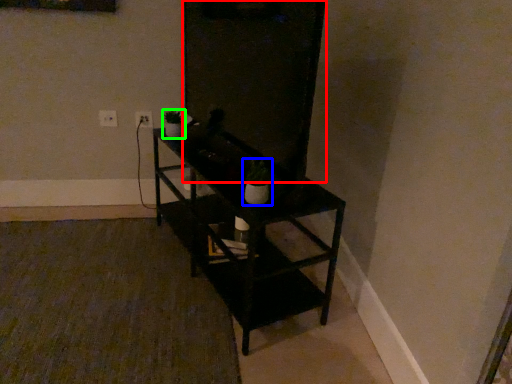
Question: Considering the real-world distances, which object is closest to glass door (highlighted by a red box)? houseplant (highlighted by a blue box) or houseplant (highlighted by a green box).

Choices:
 (A) houseplant
 (B) houseplant

Answer: (A)